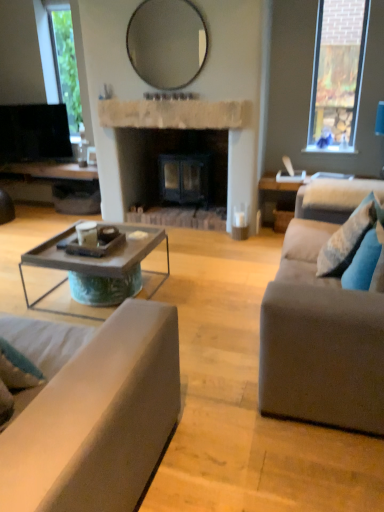
Question: Considering the positions of rustic wood coffee table at center and white stone fireplace at center in the image, is rustic wood coffee table at center taller or shorter than white stone fireplace at center?

Choices:
 (A) tall
 (B) short

Answer: (A)

Question: In terms of width, does rustic wood coffee table at center look wider or thinner when compared to white stone fireplace at center?

Choices:
 (A) wide
 (B) thin

Answer: (A)

Question: Considering the real-world distances, which object is farthest from the gray fabric couch at right, placed as the second studio couch when sorted from left to right?

Choices:
 (A) black glossy television at upper left
 (B) matte glass mirror at upper center
 (C) rustic wood coffee table at center
 (D) blue textured pillow at right, arranged as the 1th pillow when viewed from the back
 (E) matte gray couch at lower left, the first studio couch when ordered from left to right

Answer: (A)

Question: Estimate the real-world distances between objects in this image. Which object is farther from the matte gray couch at lower left, which appears as the second studio couch when viewed from the right?

Choices:
 (A) matte glass mirror at upper center
 (B) blue textured pillow at right, which is counted as the second pillow, starting from the front
 (C) blue fabric pillow at right, the 2th pillow from the back
 (D) rustic wood coffee table at center
 (E) white stone fireplace at center

Answer: (A)